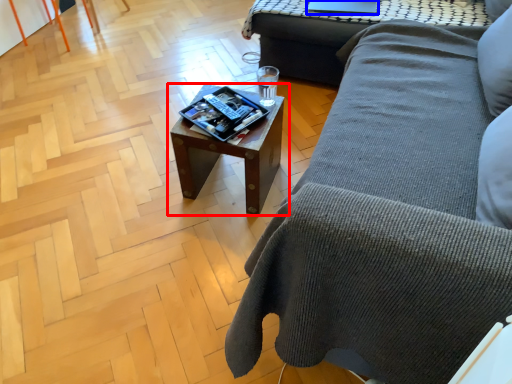
Question: Which object appears farthest to the camera in this image, table (highlighted by a red box) or laptop (highlighted by a blue box)?

Choices:
 (A) table
 (B) laptop

Answer: (B)